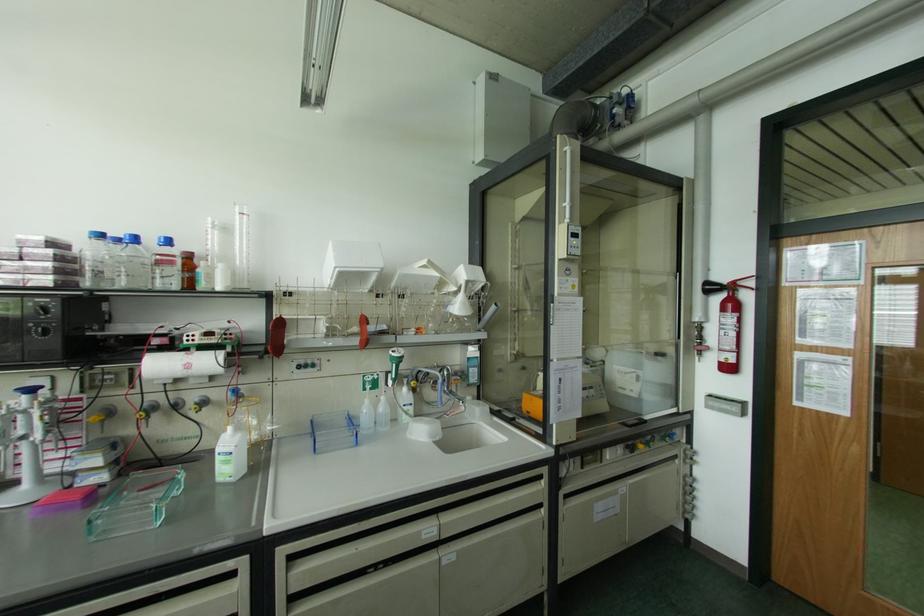
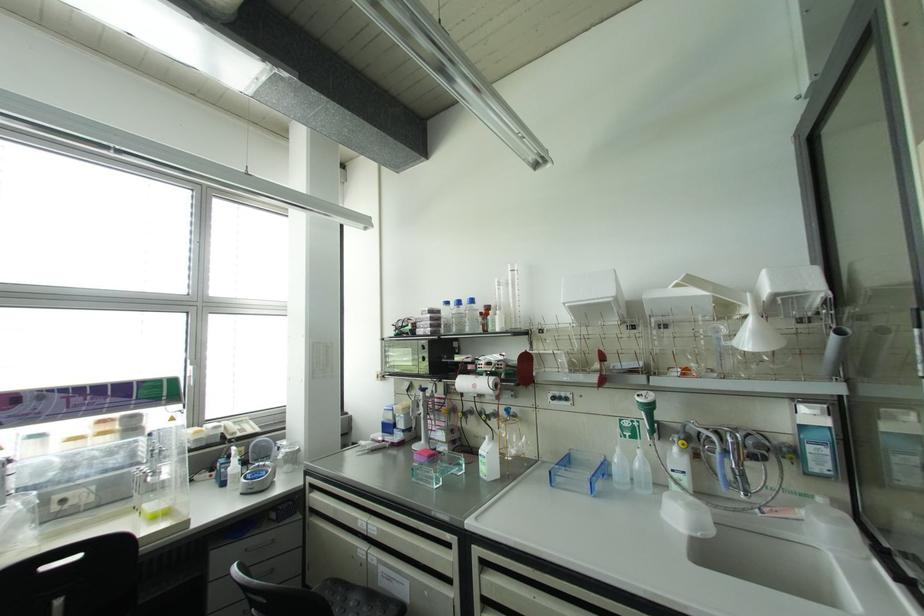
Find the pixel in the second image that matches point 293,557 in the first image.

(482, 562)